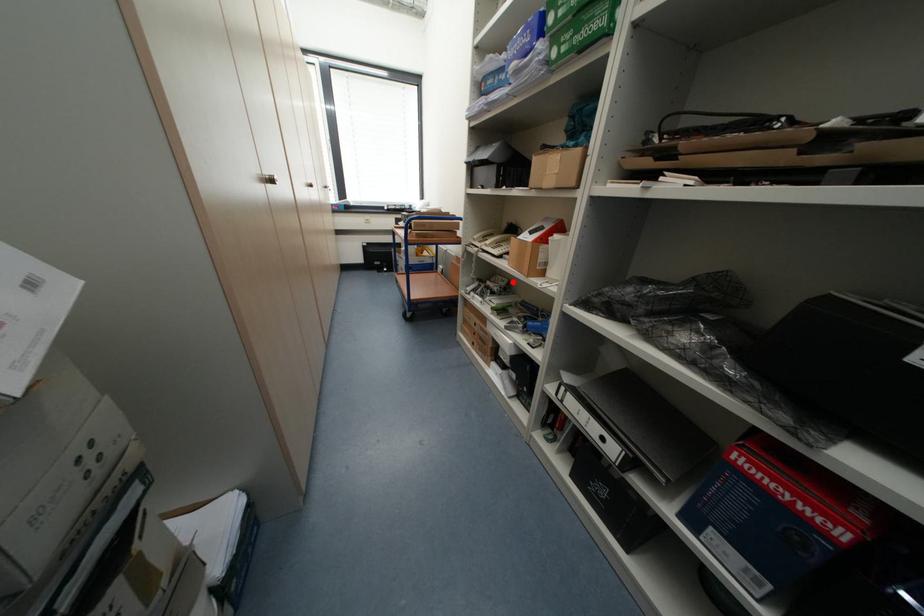
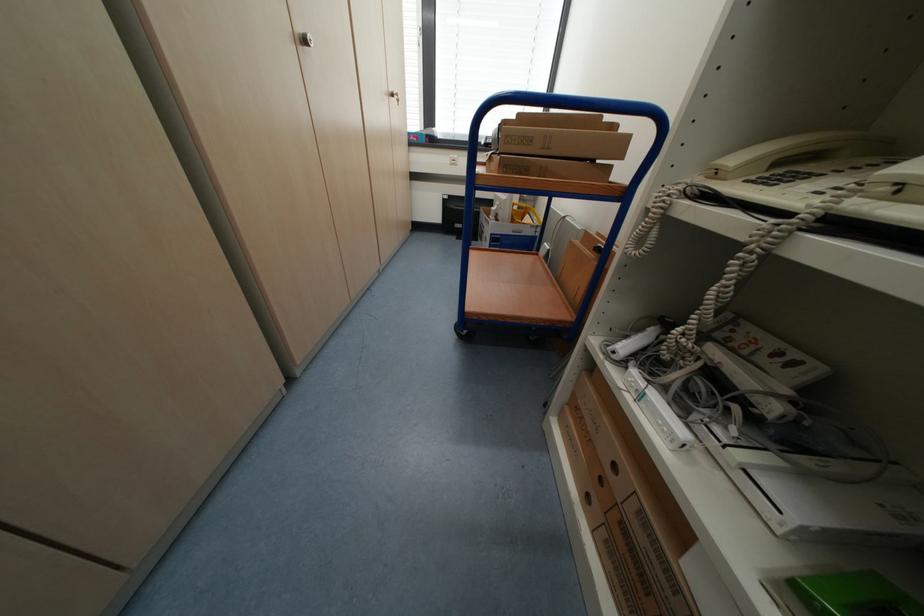
Question: I am providing you with two images of the same scene from different viewpoints. A red point is marked on the first image. Can you still see the location of the red point in image 2?

Choices:
 (A) Yes
 (B) No

Answer: (A)